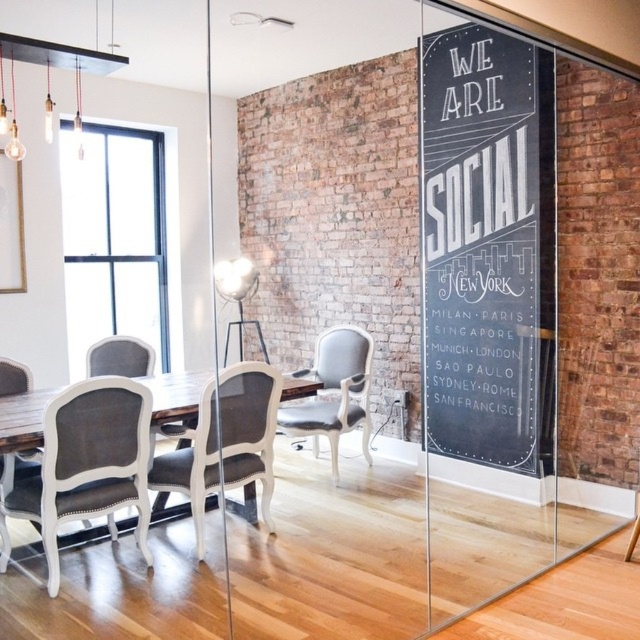
You are an office worker who wants to sit closer to the glass partition wall with the blackboard sign. Which chair should you choose between the matte gray fabric chair at lower left and the white upholstered chair at center?

The matte gray fabric chair at lower left is below the white upholstered chair at center. Since the glass partition wall is to the right of the table, the white upholstered chair at center is closer to it.

You are an office worker who needs to choose a chair for a meeting. You prefer a taller chair to have a better view. Which chair between the matte gray fabric chair at lower left and the white upholstered chair at center should you choose?

The white upholstered chair at center is taller than the matte gray fabric chair at lower left, so you should choose the white upholstered chair at center for a better view.

You are standing in the modern office space and want to move from point A to point B. Point A is at coordinates point (556, 300) and point B is at coordinates point (29, 392). Which point is closer to you when you are facing the glass partition wall with the blackboard sign?

Point B at coordinates point (29, 392) is closer to you because it is less further to the viewer than point A at coordinates point (556, 300).